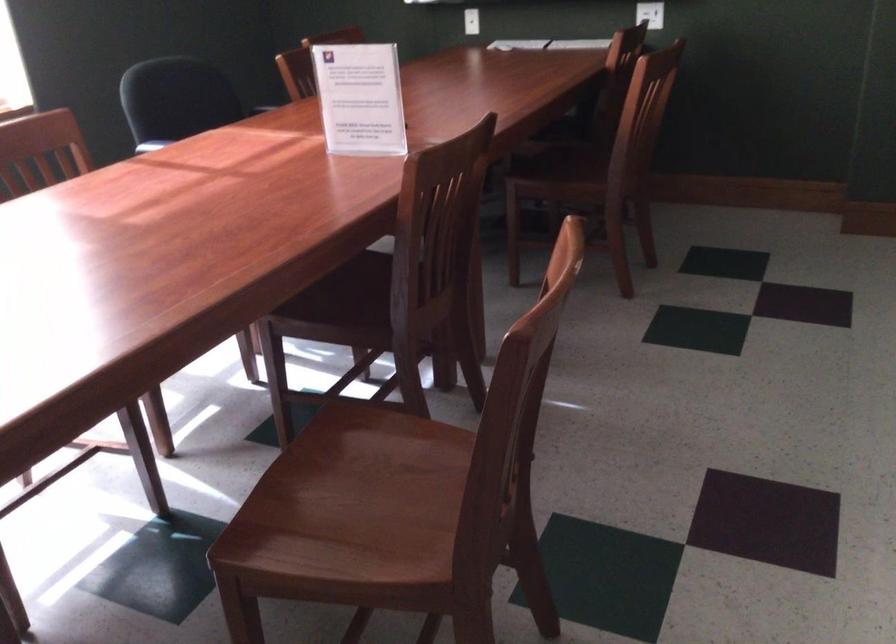
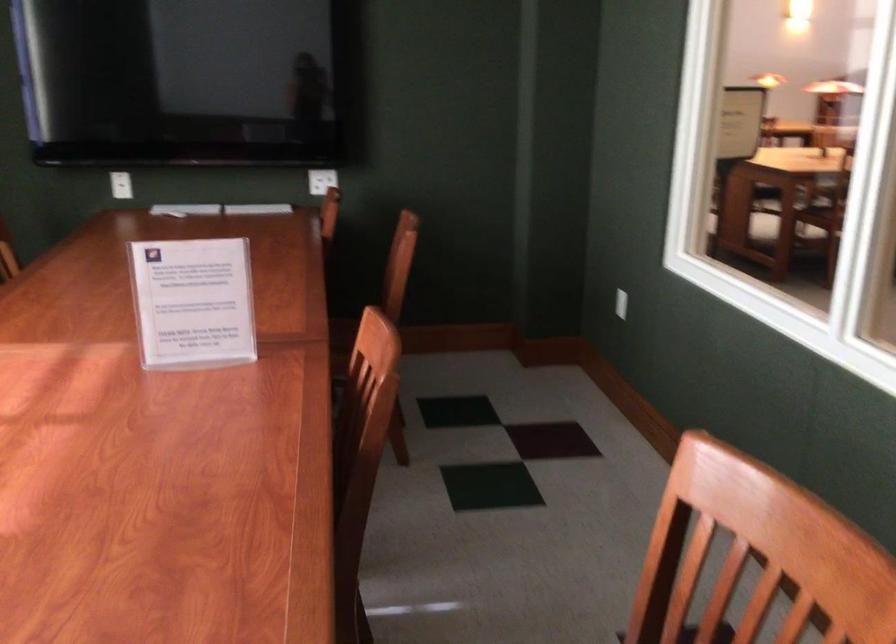
In the second image, find the point that corresponds to (x=351, y=98) in the first image.

(193, 303)